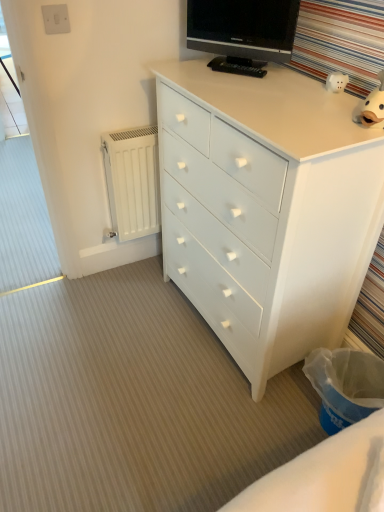
In the scene shown: Measure the distance between white painted wood chest of drawers at center and camera.

They are 99.07 centimeters apart.

I want to click on white painted wood chest of drawers at center, so click(x=267, y=208).

Describe the element at coordinates (56, 19) in the screenshot. The width and height of the screenshot is (384, 512). I see `white plastic switch at upper left` at that location.

At what (x,y) coordinates should I click in order to perform the action: click on transparent plastic screen door at upper left. Please return your answer as a coordinate pair (x, y). Looking at the image, I should click on (11, 108).

This screenshot has height=512, width=384. I want to click on black glossy tv at upper center, so click(243, 28).

Is point (371, 153) positioned behind point (108, 159)?

No.

Can you tell me how much white painted wood chest of drawers at center and white matte radiator at lower left differ in facing direction?

The angular difference between white painted wood chest of drawers at center and white matte radiator at lower left is 86.9 degrees.

From the picture: Is white painted wood chest of drawers at center oriented away from white matte radiator at lower left?

No, white painted wood chest of drawers at center is not facing away from white matte radiator at lower left.

Can you confirm if white painted wood chest of drawers at center is positioned to the right of white matte radiator at lower left?

Correct, you'll find white painted wood chest of drawers at center to the right of white matte radiator at lower left.

Which is behind, point (59, 6) or point (147, 170)?

Point (147, 170)

From a real-world perspective, is white plastic switch at upper left over white matte radiator at lower left?

Yes, from a real-world perspective, white plastic switch at upper left is on top of white matte radiator at lower left.

Identify the location of electric outlet above the white matte radiator at lower left (from the image's perspective). (56, 19).

Is white plastic switch at upper left taller or shorter than white matte radiator at lower left?

In the image, white plastic switch at upper left appears to be shorter than white matte radiator at lower left.

Is point (17, 129) farther from camera compared to point (284, 27)?

Yes, it is behind point (284, 27).

Can you confirm if transparent plastic screen door at upper left is bigger than black glossy tv at upper center?

Correct, transparent plastic screen door at upper left is larger in size than black glossy tv at upper center.

Is transparent plastic screen door at upper left to the left or to the right of black glossy tv at upper center in the image?

transparent plastic screen door at upper left is positioned on black glossy tv at upper center's left side.

From a real-world perspective, is transparent plastic screen door at upper left physically located above or below black glossy tv at upper center?

From a real-world perspective, transparent plastic screen door at upper left is physically below black glossy tv at upper center.

What's the angular difference between black glossy tv at upper center and white painted wood chest of drawers at center's facing directions?

35.6 degrees separate the facing orientations of black glossy tv at upper center and white painted wood chest of drawers at center.

Could you measure the distance between black glossy tv at upper center and white painted wood chest of drawers at center?

The distance of black glossy tv at upper center from white painted wood chest of drawers at center is 19.04 inches.

Based on the photo, which of these two, black glossy tv at upper center or white painted wood chest of drawers at center, is smaller?

black glossy tv at upper center.

Considering the relative sizes of black glossy tv at upper center and white painted wood chest of drawers at center in the image provided, is black glossy tv at upper center thinner than white painted wood chest of drawers at center?

Yes.

Between transparent plastic screen door at upper left and white plastic switch at upper left, which one has smaller width?

Thinner between the two is white plastic switch at upper left.

Which is closer, (2, 75) or (64, 27)?

Point (2, 75) is farther from the camera than point (64, 27).

Is transparent plastic screen door at upper left next to white plastic switch at upper left?

No, transparent plastic screen door at upper left is not touching white plastic switch at upper left.

In the scene shown: Is transparent plastic screen door at upper left to the left or to the right of white painted wood chest of drawers at center in the image?

transparent plastic screen door at upper left is to the left of white painted wood chest of drawers at center.

Is transparent plastic screen door at upper left in front of or behind white painted wood chest of drawers at center in the image?

Clearly, transparent plastic screen door at upper left is behind white painted wood chest of drawers at center.

Consider the image. Which of these two, transparent plastic screen door at upper left or white painted wood chest of drawers at center, is bigger?

white painted wood chest of drawers at center.

Is white plastic switch at upper left in front of or behind white painted wood chest of drawers at center in the image?

In the image, white plastic switch at upper left appears behind white painted wood chest of drawers at center.

Is white plastic switch at upper left spatially inside white painted wood chest of drawers at center, or outside of it?

white plastic switch at upper left cannot be found inside white painted wood chest of drawers at center.

Is white plastic switch at upper left to the right of white painted wood chest of drawers at center from the viewer's perspective?

Incorrect, white plastic switch at upper left is not on the right side of white painted wood chest of drawers at center.

Can you confirm if white plastic switch at upper left is smaller than white painted wood chest of drawers at center?

Indeed, white plastic switch at upper left has a smaller size compared to white painted wood chest of drawers at center.

The width and height of the screenshot is (384, 512). In order to click on chest of drawers on the right of white matte radiator at lower left in this screenshot , I will do `click(267, 208)`.

I want to click on electric outlet on the left side of white matte radiator at lower left, so click(56, 19).

Considering their positions, is transparent plastic screen door at upper left positioned further to white painted wood chest of drawers at center than white plastic switch at upper left?

transparent plastic screen door at upper left.

Looking at the image, which one is located further to transparent plastic screen door at upper left, white matte radiator at lower left or white plastic switch at upper left?

Among the two, white plastic switch at upper left is located further to transparent plastic screen door at upper left.

Considering their positions, is white painted wood chest of drawers at center positioned further to white matte radiator at lower left than black glossy tv at upper center?

Among the two, black glossy tv at upper center is located further to white matte radiator at lower left.

Looking at this image, estimate the real-world distances between objects in this image. Which object is further from white glossy piggy bank at upper right, transparent plastic screen door at upper left or white matte radiator at lower left?

transparent plastic screen door at upper left is further to white glossy piggy bank at upper right.

Estimate the real-world distances between objects in this image. Which object is further from black glossy tv at upper center, transparent plastic screen door at upper left or white glossy piggy bank at upper right?

transparent plastic screen door at upper left lies further to black glossy tv at upper center than the other object.

Considering their positions, is transparent plastic screen door at upper left positioned further to black glossy tv at upper center than white plastic switch at upper left?

Among the two, transparent plastic screen door at upper left is located further to black glossy tv at upper center.

Estimate the real-world distances between objects in this image. Which object is further from white painted wood chest of drawers at center, black glossy tv at upper center or white matte radiator at lower left?

white matte radiator at lower left.

Considering their positions, is black glossy tv at upper center positioned further to white glossy piggy bank at upper right than white painted wood chest of drawers at center?

white painted wood chest of drawers at center is further to white glossy piggy bank at upper right.

Locate an element on the screen. radiator positioned between white glossy piggy bank at upper right and transparent plastic screen door at upper left from near to far is located at coordinates coord(132,181).

The height and width of the screenshot is (512, 384). In order to click on television between white matte radiator at lower left and white glossy piggy bank at upper right in the horizontal direction in this screenshot , I will do `click(243, 28)`.

Identify the location of television between white painted wood chest of drawers at center and white matte radiator at lower left in the front-back direction. (243, 28).

Find the location of `radiator located between white painted wood chest of drawers at center and transparent plastic screen door at upper left in the depth direction`. radiator located between white painted wood chest of drawers at center and transparent plastic screen door at upper left in the depth direction is located at coordinates (132, 181).